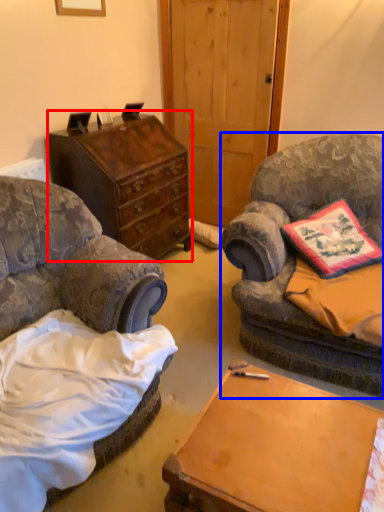
Question: Which object is closer to the camera taking this photo, chest of drawers (highlighted by a red box) or chair (highlighted by a blue box)?

Choices:
 (A) chest of drawers
 (B) chair

Answer: (B)